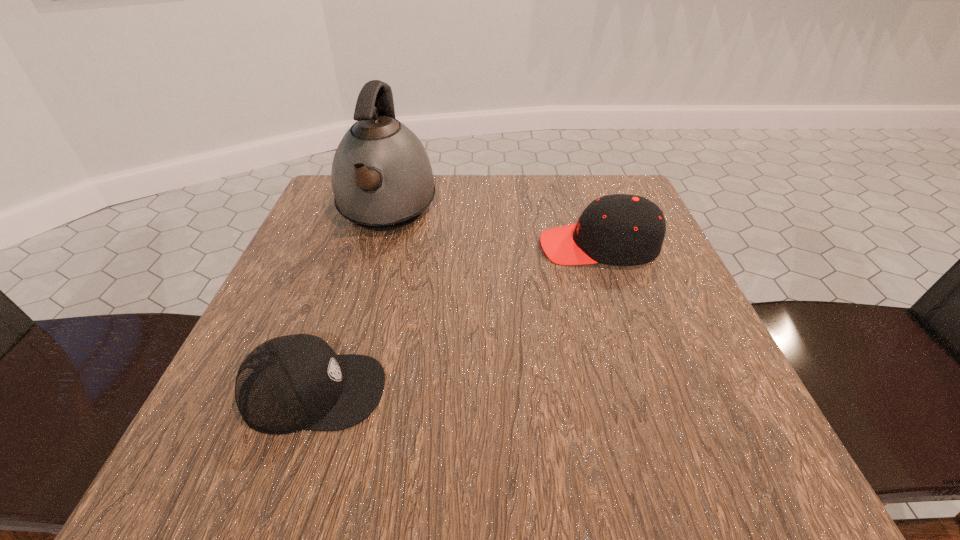
At what (x,y) coordinates should I click in order to perform the action: click on the tallest object. Please return your answer as a coordinate pair (x, y). Looking at the image, I should click on (382, 179).

The height and width of the screenshot is (540, 960). I want to click on the rightmost object, so click(620, 229).

In order to click on the farther cap in this screenshot , I will do `click(620, 229)`.

I want to click on the shorter cap, so click(x=290, y=383).

Where is `the left cap`? The width and height of the screenshot is (960, 540). the left cap is located at coordinates (290, 383).

Locate an element on the screen. This screenshot has height=540, width=960. free spot located at the spout of the tallest object is located at coordinates (362, 298).

Where is `free space located on the front-facing side of the right cap`? The height and width of the screenshot is (540, 960). free space located on the front-facing side of the right cap is located at coordinates (515, 246).

Image resolution: width=960 pixels, height=540 pixels. I want to click on vacant space positioned on the front-facing side of the right cap, so click(x=411, y=246).

You are a GUI agent. You are given a task and a screenshot of the screen. Output one action in this format:
    pyautogui.click(x=<x>, y=<y>)
    Task: Click on the vacant space located 0.280m on the front-facing side of the right cap
    This screenshot has height=540, width=960.
    Given the screenshot: What is the action you would take?
    pyautogui.click(x=400, y=246)

At what (x,y) coordinates should I click in order to perform the action: click on vacant region located on the front-facing side of the nearest object. Please return your answer as a coordinate pair (x, y). This screenshot has width=960, height=540. Looking at the image, I should click on (420, 392).